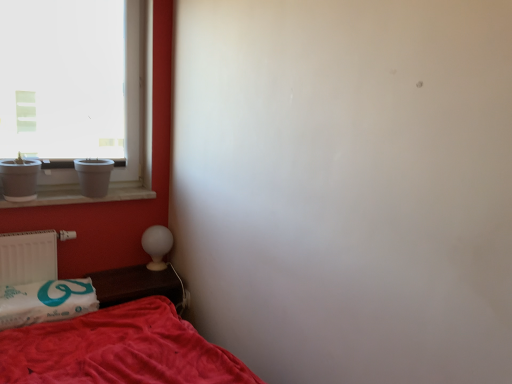
Locate an element on the screen. vacant area that is in front of white glossy table lamp at lower left is located at coordinates (147, 284).